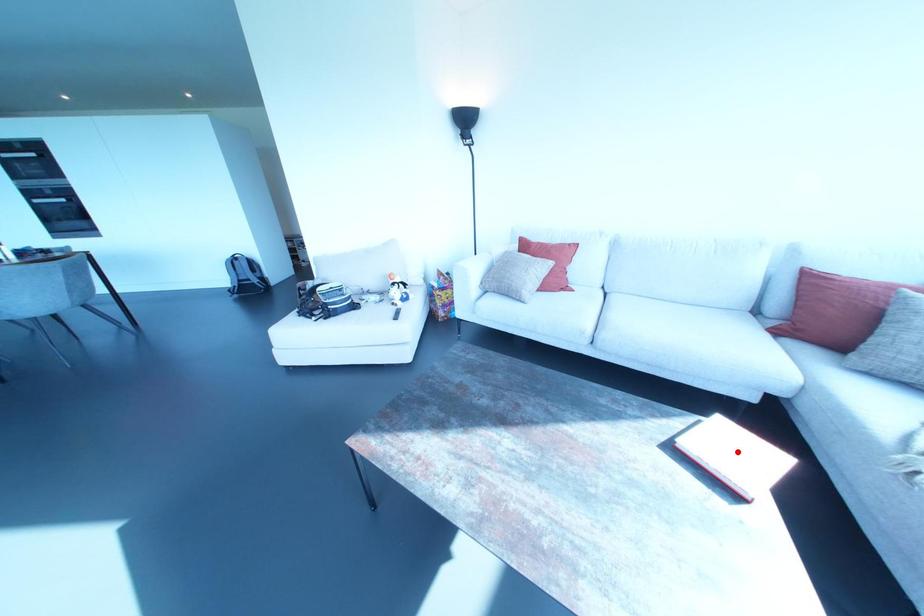
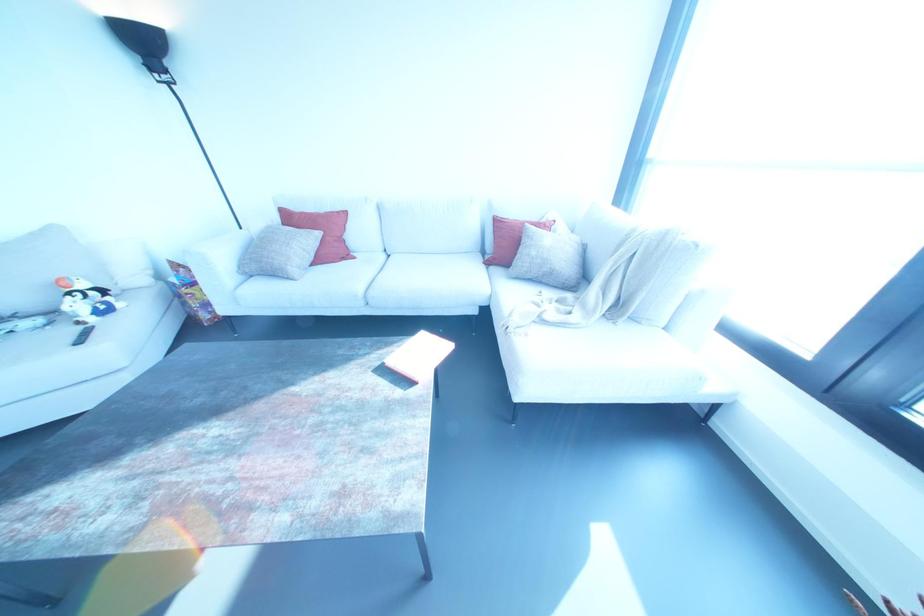
In the second image, find the point that corresponds to the highlighted location in the first image.

(423, 352)